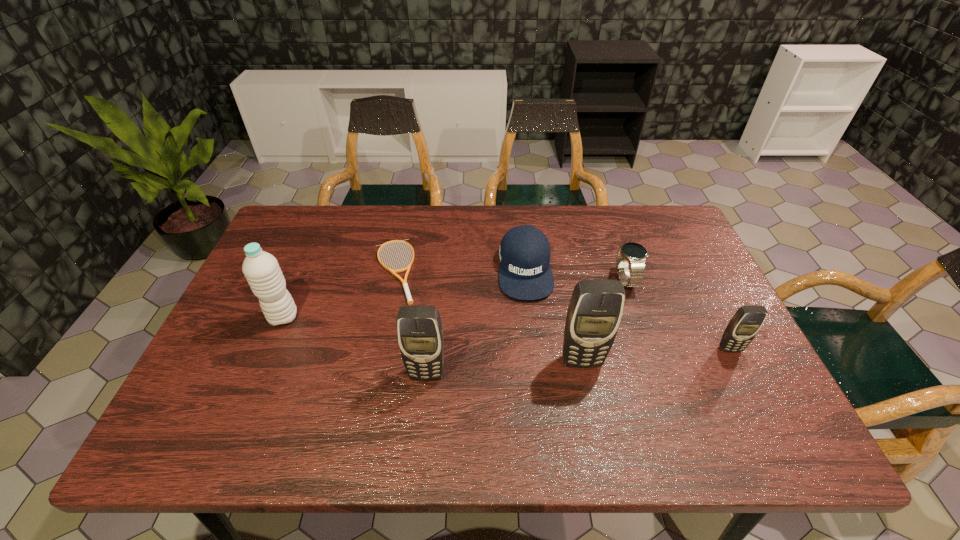
The width and height of the screenshot is (960, 540). Identify the location of free point between the fourth farthest object and the fifth object from right to left. (355, 346).

Find the location of a particular element. This screenshot has height=540, width=960. free spot between the water bottle and the second object from left to right is located at coordinates (339, 294).

This screenshot has width=960, height=540. What are the coordinates of `vacant area between the watch and the baseball cap` in the screenshot? It's located at (575, 275).

Identify the location of vacant area between the tennis racket and the second cellular telephone from right to left. (x=488, y=316).

Select which object is the sixth closest to the tennis racket. Please provide its 2D coordinates. Your answer should be formatted as a tuple, i.e. [(x, y)], where the tuple contains the x and y coordinates of a point satisfying the conditions above.

[(747, 321)]

Image resolution: width=960 pixels, height=540 pixels. What are the coordinates of `object that is the second closest to the leftmost object` in the screenshot? It's located at (420, 336).

Select which cellular telephone is the third closest to the baseball cap. Please provide its 2D coordinates. Your answer should be formatted as a tuple, i.e. [(x, y)], where the tuple contains the x and y coordinates of a point satisfying the conditions above.

[(747, 321)]

Point out which cellular telephone is positioned as the nearest to the sixth object from left to right. Please provide its 2D coordinates. Your answer should be formatted as a tuple, i.e. [(x, y)], where the tuple contains the x and y coordinates of a point satisfying the conditions above.

[(594, 314)]

Identify the location of blank area in the image that satisfies the following two spatial constraints: 1. on the back side of the water bottle; 2. on the left side of the shortest object. (303, 271).